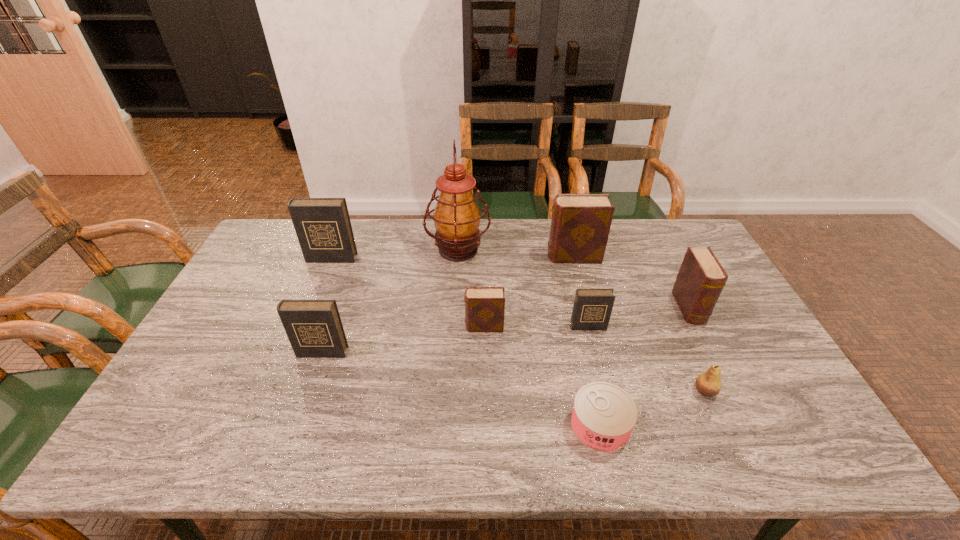
The image size is (960, 540). I want to click on the second closest brown diary to the rightmost diary, so click(484, 306).

Locate an element on the screen. This screenshot has height=540, width=960. dark diary that is the second closest to the tallest object is located at coordinates (592, 308).

Where is `the closest dark diary to the rightmost dark diary`? This screenshot has width=960, height=540. the closest dark diary to the rightmost dark diary is located at coordinates (314, 328).

This screenshot has width=960, height=540. Identify the location of vacant area in the image that satisfies the following two spatial constraints: 1. on the back side of the eighth object from left to right; 2. on the spine side of the second brown diary from left to right. (644, 256).

What are the coordinates of `free space that satisfies the following two spatial constraints: 1. on the spine side of the farthest brown diary; 2. on the front cover of the nearest dark diary` in the screenshot? It's located at (598, 352).

The height and width of the screenshot is (540, 960). In order to click on free location that satisfies the following two spatial constraints: 1. on the spine side of the leftmost brown diary; 2. on the front cover of the nearest dark diary in this screenshot , I will do `click(485, 352)`.